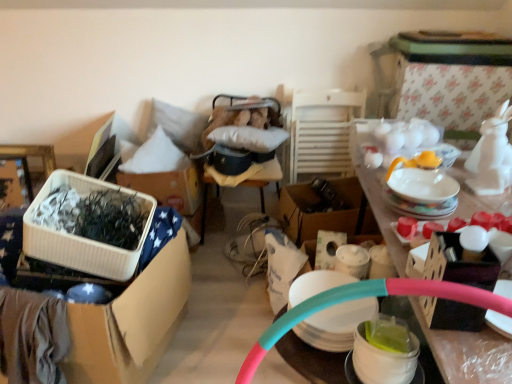
Question: From the image's perspective, is white glossy table at upper right positioned above or below white soft pillow at upper left?

Choices:
 (A) above
 (B) below

Answer: (B)

Question: Is white glossy table at upper right inside or outside of white soft pillow at upper left?

Choices:
 (A) outside
 (B) inside

Answer: (A)

Question: Estimate the real-world distances between objects in this image. Which object is farther from the white glossy bowl at lower right?

Choices:
 (A) white cardboard box at center
 (B) cardboard box at center, placed as the first box when sorted from back to front
 (C) white glossy table at upper right
 (D) white soft pillow at upper left
 (E) translucent plastic cups at center

Answer: (D)

Question: Considering the real-world distances, which object is closest to the translucent plastic cups at center?

Choices:
 (A) white glossy bowl at lower right
 (B) white plastic container at left, which is counted as the 2th box, starting from the right
 (C) white cardboard box at center
 (D) white soft pillow at upper left
 (E) white wooden chair at center

Answer: (A)